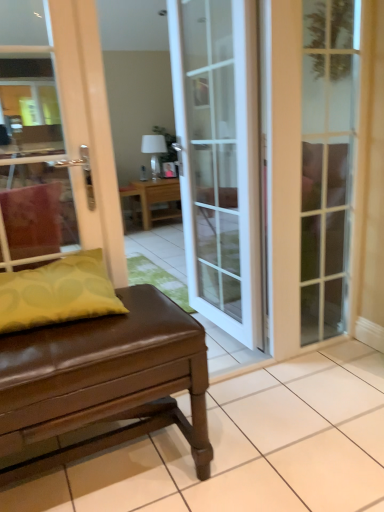
Question: Is wooden table at center, the second table when ordered from front to back, facing towards yellow fabric pillow at left?

Choices:
 (A) yes
 (B) no

Answer: (B)

Question: Is wooden table at center, positioned as the 1th table in top-to-bottom order, outside yellow fabric pillow at left?

Choices:
 (A) yes
 (B) no

Answer: (A)

Question: Is wooden table at center, positioned as the 1th table in top-to-bottom order, to the left of yellow fabric pillow at left from the viewer's perspective?

Choices:
 (A) no
 (B) yes

Answer: (A)

Question: Is wooden table at center, acting as the first table starting from the back, far from yellow fabric pillow at left?

Choices:
 (A) yes
 (B) no

Answer: (A)

Question: From a real-world perspective, is wooden table at center, acting as the first table starting from the back, located higher than yellow fabric pillow at left?

Choices:
 (A) yes
 (B) no

Answer: (B)

Question: Would you say yellow fabric pillow at left is inside or outside white glass door at center, the second door in the right-to-left sequence?

Choices:
 (A) outside
 (B) inside

Answer: (A)

Question: Relative to white glass door at center, marked as the first door in a left-to-right arrangement, is yellow fabric pillow at left in front or behind?

Choices:
 (A) front
 (B) behind

Answer: (A)

Question: Is yellow fabric pillow at left taller or shorter than white glass door at center, marked as the first door in a left-to-right arrangement?

Choices:
 (A) tall
 (B) short

Answer: (B)

Question: From a real-world perspective, is yellow fabric pillow at left positioned above or below white glass door at center, marked as the first door in a left-to-right arrangement?

Choices:
 (A) above
 (B) below

Answer: (B)

Question: Is point (205, 88) positioned closer to the camera than point (274, 156)?

Choices:
 (A) farther
 (B) closer

Answer: (A)

Question: Is white glass door at center, marked as the first door in a left-to-right arrangement, bigger or smaller than clear glass door at right, arranged as the second door when viewed from the left?

Choices:
 (A) big
 (B) small

Answer: (A)

Question: From a real-world perspective, is white glass door at center, marked as the first door in a left-to-right arrangement, physically located above or below clear glass door at right, arranged as the second door when viewed from the left?

Choices:
 (A) above
 (B) below

Answer: (A)

Question: Based on their positions, is white glass door at center, the second door in the right-to-left sequence, located to the left or right of clear glass door at right, the first door positioned from the right?

Choices:
 (A) right
 (B) left

Answer: (B)

Question: In the image, is wooden table at center, which is the second table from bottom to top, positioned in front of or behind white glass door at center, marked as the first door in a left-to-right arrangement?

Choices:
 (A) behind
 (B) front

Answer: (A)

Question: Considering the positions of point (147, 201) and point (192, 80), is point (147, 201) closer or farther from the camera than point (192, 80)?

Choices:
 (A) closer
 (B) farther

Answer: (B)